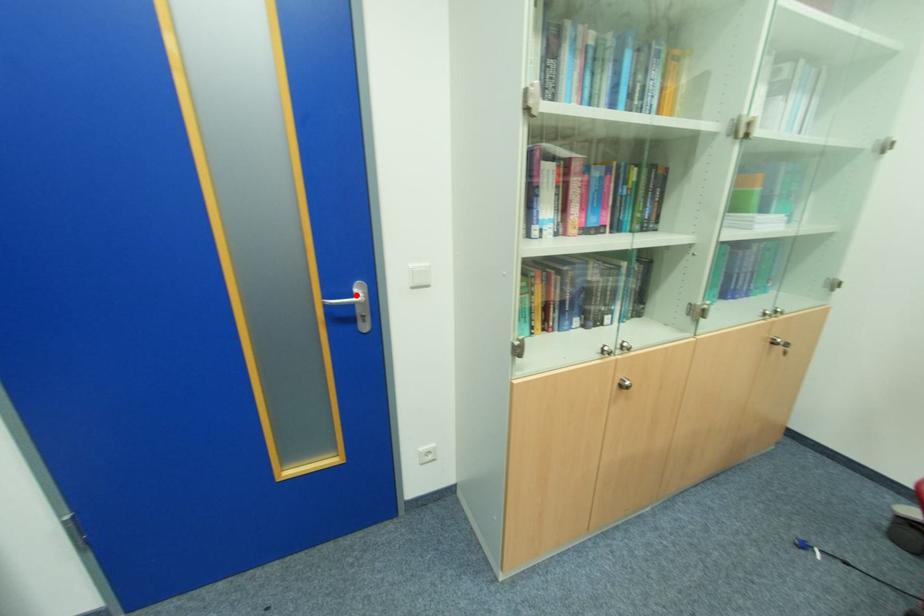
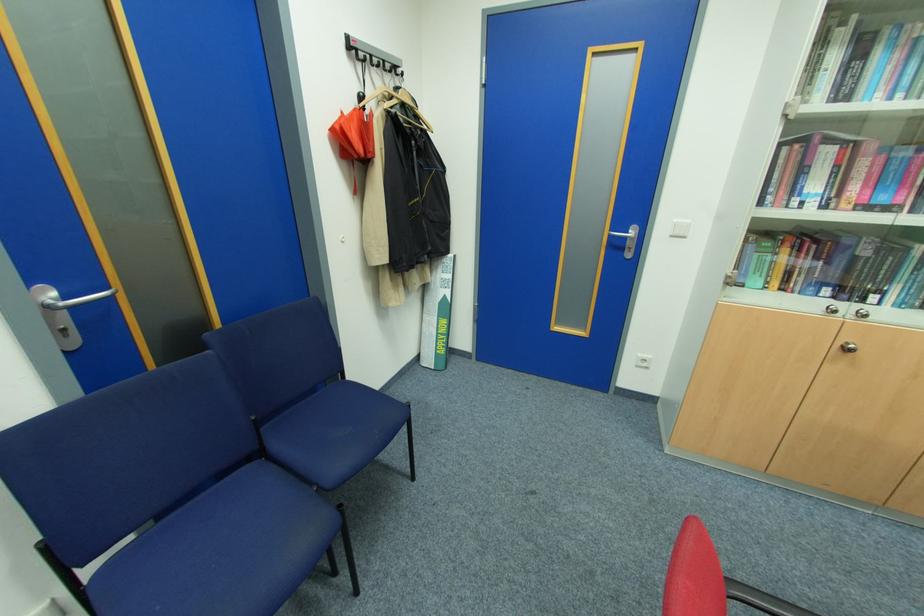
Question: I am providing you with two images of the same scene from different viewpoints. A red point is marked on the first image. Is the red point's position out of view in image 2?

Choices:
 (A) Yes
 (B) No

Answer: (B)